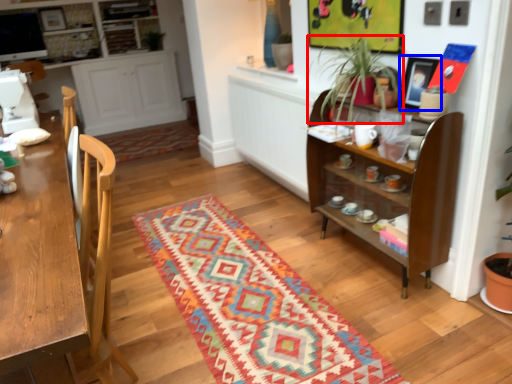
Question: Which of the following is the farthest to the observer, houseplant (highlighted by a red box) or picture frame (highlighted by a blue box)?

Choices:
 (A) houseplant
 (B) picture frame

Answer: (B)